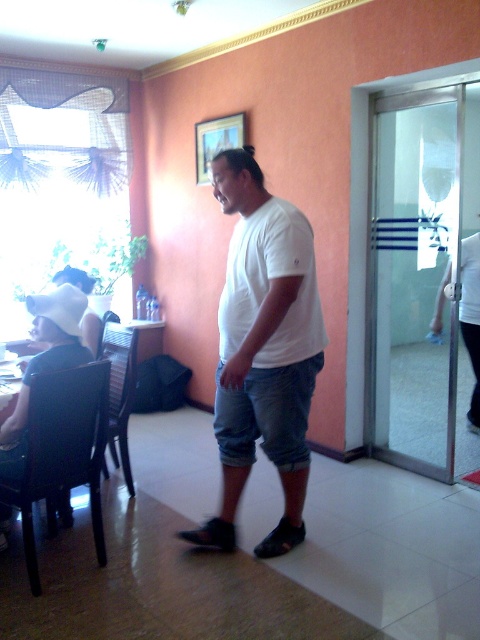
You are standing in the dining area and want to exit through the transparent glass door at right. Based on the scene description, can you determine the approximate direction you need to walk to reach it?

The transparent glass door at right is located at point coordinates approximately 0.433 on the x axis and 0.865 on the y axis. Since the coordinate system typically places the origin at the bottom left corner, this means the door is positioned towards the lower right side of the image. To reach it from the dining area, you should walk towards the lower right direction.